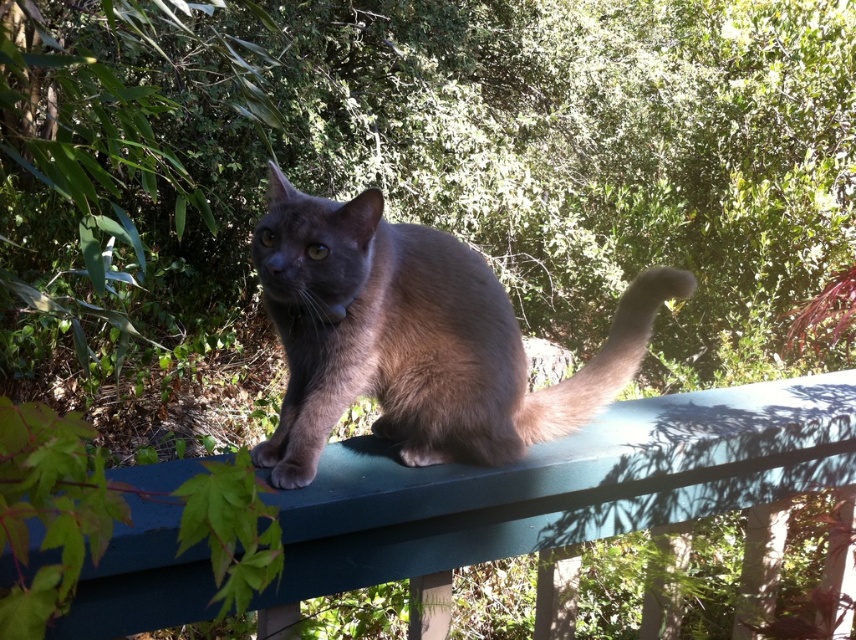
You are standing in a garden where a gray cat is sitting on a teal railing. You notice two points marked in the scene. Which point is closer to you, point (830, 403) or point (479, 310)?

Point (830, 403) is closer to you because it is further to the viewer than point (479, 310).

You are a photographer trying to capture the matte gray cat at center and the green painted wood at center in a single shot. Based on their positions, which object should you adjust your camera to focus on first to ensure both are in frame?

The green painted wood at center is to the right of the matte gray cat at center, so you should focus on the matte gray cat at center first to ensure both are in frame.

You are a photographer trying to capture a closeup of the matte gray cat at center and the fuzzy brown tail at upper center. Which object should you focus on first if you want to ensure both are in focus?

The matte gray cat at center is taller than the fuzzy brown tail at upper center, so focusing on the matte gray cat at center first will help ensure both are in focus since it is the larger subject.